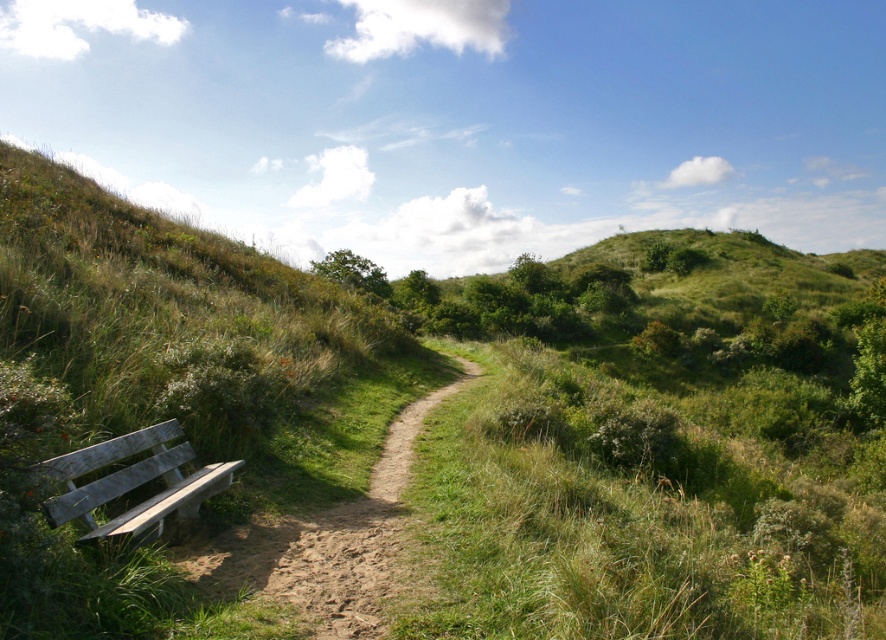
Is brown dirt path at center smaller than weathered wood bench at lower left?

Incorrect, brown dirt path at center is not smaller in size than weathered wood bench at lower left.

Does brown dirt path at center have a greater height compared to weathered wood bench at lower left?

Incorrect, brown dirt path at center's height is not larger of weathered wood bench at lower left's.

Who is more distant from viewer, (351, 570) or (160, 456)?

The point (160, 456) is more distant.

Locate an element on the screen. This screenshot has height=640, width=886. brown dirt path at center is located at coordinates (315, 552).